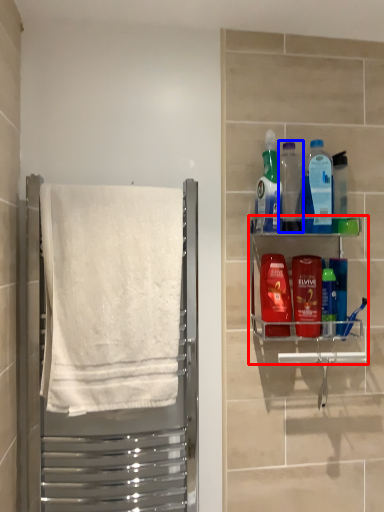
Question: Which point is closer to the camera, shelf (highlighted by a red box) or bottle (highlighted by a blue box)?

Choices:
 (A) shelf
 (B) bottle

Answer: (A)